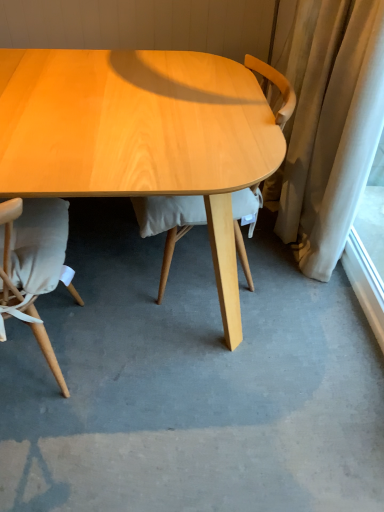
Question: Is point (11, 226) positioned closer to the camera than point (377, 331)?

Choices:
 (A) farther
 (B) closer

Answer: (B)

Question: From a real-world perspective, relative to white sheer curtain at right, is matte beige chair at lower left, the 2th chair when ordered from right to left, vertically above or below?

Choices:
 (A) above
 (B) below

Answer: (A)

Question: Which is farther from the white sheer curtain at right?

Choices:
 (A) matte beige chair at lower left, the 2th chair when ordered from right to left
 (B) light wood chair at center, the 1th chair positioned from the right

Answer: (A)

Question: Which is nearer to the light wood chair at center, which is counted as the second chair, starting from the left?

Choices:
 (A) white sheer curtain at right
 (B) matte beige chair at lower left, the 1th chair in the left-to-right sequence

Answer: (B)